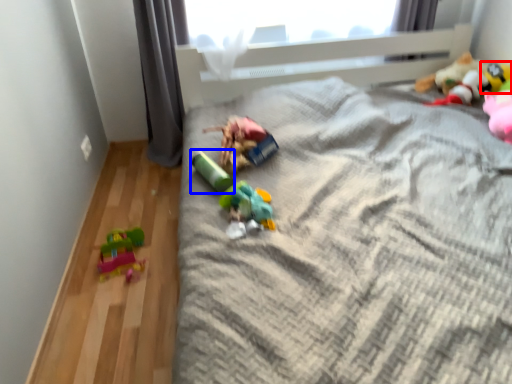
Question: Which object appears closest to the camera in this image, toy (highlighted by a red box) or toy (highlighted by a blue box)?

Choices:
 (A) toy
 (B) toy

Answer: (B)